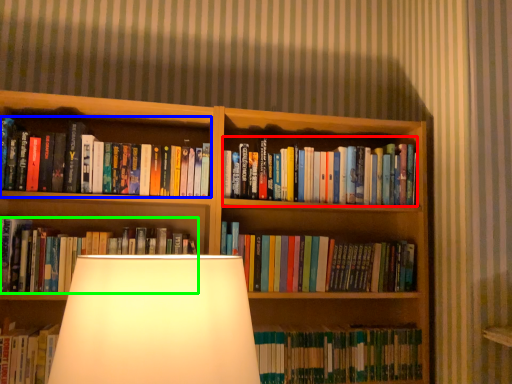
Question: Which object is the closest to the book (highlighted by a red box)? Choose among these: book (highlighted by a blue box) or book (highlighted by a green box).

Choices:
 (A) book
 (B) book

Answer: (A)